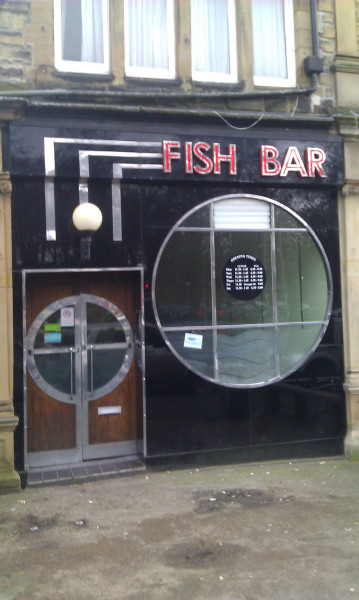
The width and height of the screenshot is (359, 600). Find the location of `round window`. round window is located at coordinates (311, 298).